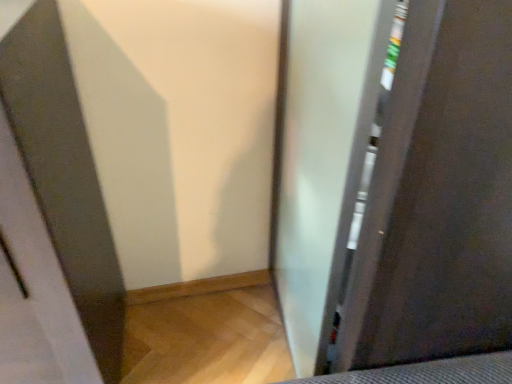
Question: Can you confirm if clear glass screen door at left, which ranks as the second screen door in right-to-left order, is positioned to the right of frosted glass screen door at right, arranged as the first screen door when viewed from the right?

Choices:
 (A) no
 (B) yes

Answer: (A)

Question: From a real-world perspective, is clear glass screen door at left, acting as the first screen door starting from the left, under frosted glass screen door at right, the 2th screen door when ordered from left to right?

Choices:
 (A) yes
 (B) no

Answer: (A)

Question: Does clear glass screen door at left, acting as the first screen door starting from the left, have a lesser width compared to frosted glass screen door at right, arranged as the first screen door when viewed from the right?

Choices:
 (A) yes
 (B) no

Answer: (B)

Question: Is clear glass screen door at left, which ranks as the second screen door in right-to-left order, at the left side of frosted glass screen door at right, the 2th screen door when ordered from left to right?

Choices:
 (A) no
 (B) yes

Answer: (B)

Question: Considering the relative sizes of clear glass screen door at left, acting as the first screen door starting from the left, and frosted glass screen door at right, arranged as the first screen door when viewed from the right, in the image provided, is clear glass screen door at left, acting as the first screen door starting from the left, taller than frosted glass screen door at right, arranged as the first screen door when viewed from the right,?

Choices:
 (A) yes
 (B) no

Answer: (B)

Question: From the image's perspective, is clear glass screen door at left, which ranks as the second screen door in right-to-left order, under frosted glass screen door at right, arranged as the first screen door when viewed from the right?

Choices:
 (A) no
 (B) yes

Answer: (B)

Question: From the image's perspective, is frosted glass screen door at right, arranged as the first screen door when viewed from the right, located beneath clear glass screen door at left, acting as the first screen door starting from the left?

Choices:
 (A) yes
 (B) no

Answer: (B)

Question: Is frosted glass screen door at right, arranged as the first screen door when viewed from the right, facing towards clear glass screen door at left, which ranks as the second screen door in right-to-left order?

Choices:
 (A) yes
 (B) no

Answer: (A)

Question: Is frosted glass screen door at right, arranged as the first screen door when viewed from the right, looking in the opposite direction of clear glass screen door at left, acting as the first screen door starting from the left?

Choices:
 (A) yes
 (B) no

Answer: (A)

Question: From a real-world perspective, is frosted glass screen door at right, the 2th screen door when ordered from left to right, on clear glass screen door at left, which ranks as the second screen door in right-to-left order?

Choices:
 (A) no
 (B) yes

Answer: (B)

Question: Is frosted glass screen door at right, the 2th screen door when ordered from left to right, to the left of clear glass screen door at left, which ranks as the second screen door in right-to-left order, from the viewer's perspective?

Choices:
 (A) no
 (B) yes

Answer: (A)

Question: Is the position of frosted glass screen door at right, the 2th screen door when ordered from left to right, more distant than that of clear glass screen door at left, acting as the first screen door starting from the left?

Choices:
 (A) yes
 (B) no

Answer: (A)

Question: Is point (29, 100) positioned closer to the camera than point (387, 117)?

Choices:
 (A) farther
 (B) closer

Answer: (A)